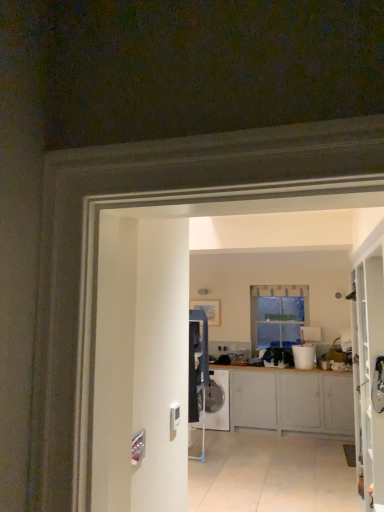
Question: Considering the relative positions of clear glass window at center and white glossy bucket at center in the image provided, is clear glass window at center to the left of white glossy bucket at center from the viewer's perspective?

Choices:
 (A) no
 (B) yes

Answer: (B)

Question: Can you confirm if clear glass window at center is wider than white glossy bucket at center?

Choices:
 (A) yes
 (B) no

Answer: (B)

Question: Is clear glass window at center not close to white glossy bucket at center?

Choices:
 (A) yes
 (B) no

Answer: (B)

Question: Is clear glass window at center taller than white glossy bucket at center?

Choices:
 (A) yes
 (B) no

Answer: (A)

Question: Is clear glass window at center in contact with white glossy bucket at center?

Choices:
 (A) yes
 (B) no

Answer: (B)

Question: Considering the positions of point pos(251,392) and point pos(311,356), is point pos(251,392) closer or farther from the camera than point pos(311,356)?

Choices:
 (A) closer
 (B) farther

Answer: (A)

Question: Is matte gray cabinets at center taller or shorter than white glossy bucket at center?

Choices:
 (A) short
 (B) tall

Answer: (B)

Question: Considering their positions, is matte gray cabinets at center located in front of or behind white glossy bucket at center?

Choices:
 (A) front
 (B) behind

Answer: (A)

Question: In terms of size, does matte gray cabinets at center appear bigger or smaller than white glossy bucket at center?

Choices:
 (A) small
 (B) big

Answer: (B)

Question: Is point (226, 414) positioned closer to the camera than point (332, 409)?

Choices:
 (A) farther
 (B) closer

Answer: (A)

Question: From the image's perspective, is white glossy washing machine at center positioned above or below matte gray cabinets at center?

Choices:
 (A) above
 (B) below

Answer: (B)

Question: Is white glossy washing machine at center to the left or to the right of matte gray cabinets at center in the image?

Choices:
 (A) right
 (B) left

Answer: (B)

Question: In terms of size, does white glossy washing machine at center appear bigger or smaller than matte gray cabinets at center?

Choices:
 (A) big
 (B) small

Answer: (B)

Question: Considering the positions of white glossy bucket at center and white glossy washing machine at center in the image, is white glossy bucket at center bigger or smaller than white glossy washing machine at center?

Choices:
 (A) big
 (B) small

Answer: (B)

Question: Is white glossy bucket at center situated inside white glossy washing machine at center or outside?

Choices:
 (A) outside
 (B) inside

Answer: (A)